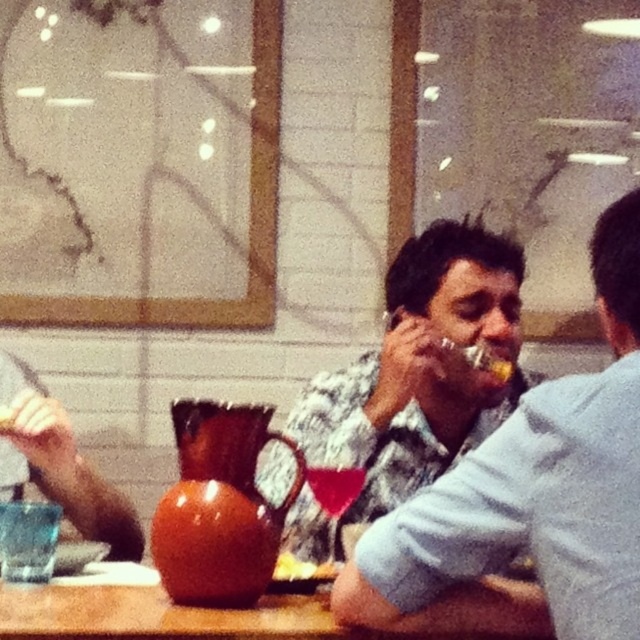
Looking at this image, you are a waiter at the restaurant and need to place a new menu between the matte plastic fork at center and the translucent glass at center. Based on their positions, where should you place the menu?

The matte plastic fork at center is to the right of the translucent glass at center, so you should place the menu to the right of the translucent glass at center but before the matte plastic fork at center to keep it between them.

You are a server at a restaurant and need to place a 12 inch long plate between the matte plastic fork at center and the translucent glass at center. Can the plate fit between them without overlapping either object?

The distance between the matte plastic fork at center and the translucent glass at center is 13.60 inches. Since the plate is 12 inches long, there is enough space to place it between them without overlapping either object.